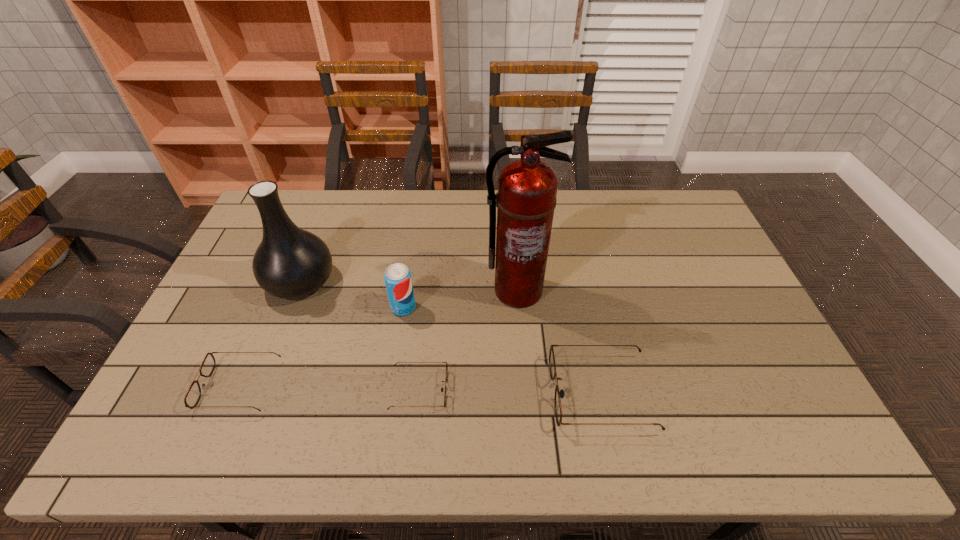
Locate an element on the screen. This screenshot has height=540, width=960. the second tallest sunglasses is located at coordinates (192, 397).

The width and height of the screenshot is (960, 540). I want to click on the leftmost sunglasses, so click(x=192, y=397).

The height and width of the screenshot is (540, 960). What are the coordinates of `the second sunglasses from right to left` in the screenshot? It's located at (446, 376).

Find the location of a particular element. the shortest object is located at coordinates (446, 376).

Where is `the tallest sunglasses`? the tallest sunglasses is located at coordinates (552, 366).

At what (x,y) coordinates should I click in order to perform the action: click on the rightmost sunglasses. Please return your answer as a coordinate pair (x, y). Looking at the image, I should click on (552, 366).

Locate an element on the screen. The width and height of the screenshot is (960, 540). the third tallest object is located at coordinates (398, 280).

The width and height of the screenshot is (960, 540). I want to click on vase, so click(289, 263).

The height and width of the screenshot is (540, 960). Find the location of `the tallest object`. the tallest object is located at coordinates (527, 188).

This screenshot has width=960, height=540. Find the location of `free space located 0.100m on the front-facing side of the second shortest sunglasses`. free space located 0.100m on the front-facing side of the second shortest sunglasses is located at coordinates (166, 386).